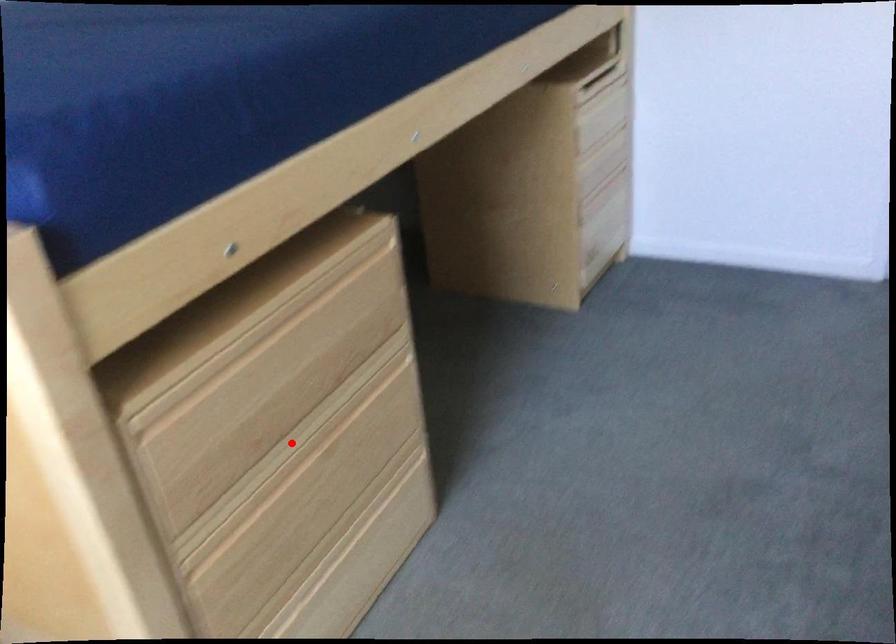
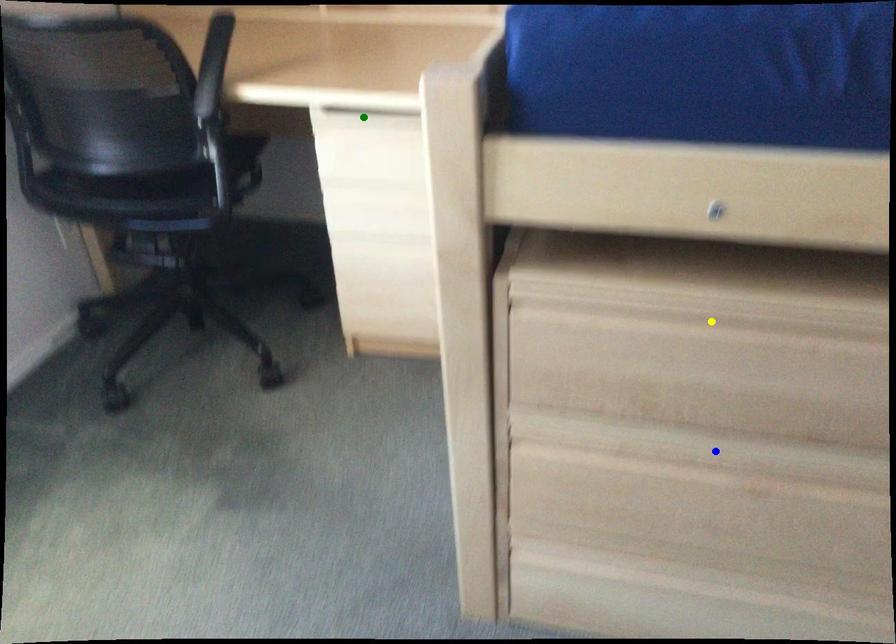
Question: I am providing you with two images of the same scene from different viewpoints. A red point is marked on the first image. You are given multiple points on the second image. In image 2, which mark is for the same physical point as the one in image 1?

Choices:
 (A) green point
 (B) blue point
 (C) yellow point

Answer: (B)